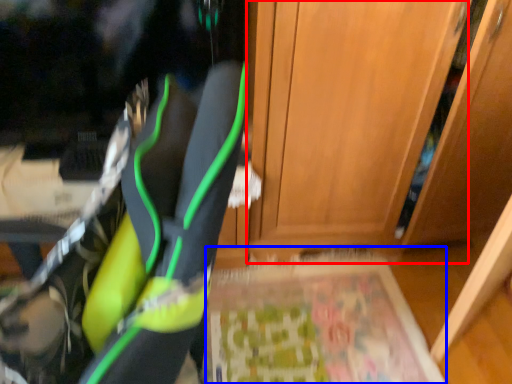
Question: Which object appears closest to the camera in this image, door (highlighted by a red box) or yoga mat (highlighted by a blue box)?

Choices:
 (A) door
 (B) yoga mat

Answer: (A)